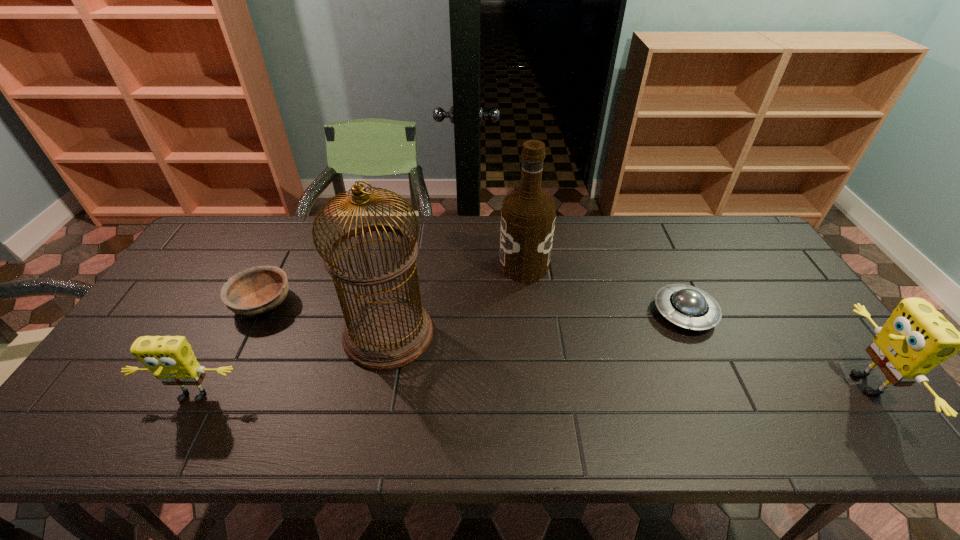
Please determine a free point for an extra sponge to ensure balance. Please provide its 2D coordinates. Your answer should be formatted as a tuple, i.e. [(x, y)], where the tuple contains the x and y coordinates of a point satisfying the conditions above.

[(532, 390)]